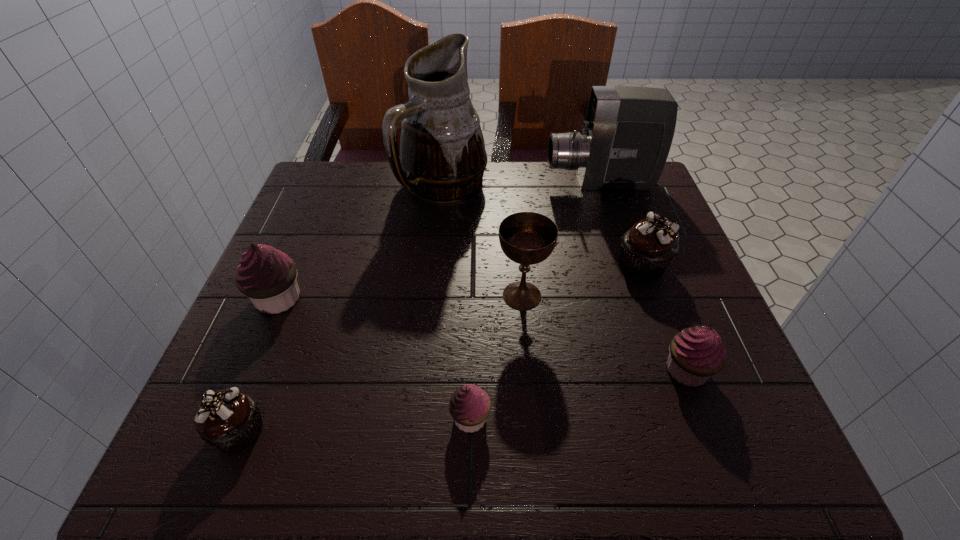
Where is `the third cupcake from right to left`? The height and width of the screenshot is (540, 960). the third cupcake from right to left is located at coordinates (469, 406).

Locate an element on the screen. The height and width of the screenshot is (540, 960). the smallest pink cupcake is located at coordinates (469, 406).

Image resolution: width=960 pixels, height=540 pixels. Identify the location of the left brown cupcake. (230, 420).

At what (x,y) coordinates should I click in order to perform the action: click on the smaller brown cupcake. Please return your answer as a coordinate pair (x, y). Looking at the image, I should click on (230, 420).

Find the location of a particular element. The width and height of the screenshot is (960, 540). vacant space situated 0.110m from the spout of the tallest object is located at coordinates (438, 248).

I want to click on vacant position located at the front of the camcorder, highlighting the lens, so click(x=433, y=183).

You are a GUI agent. You are given a task and a screenshot of the screen. Output one action in this format:
    pyautogui.click(x=<x>, y=<y>)
    Task: Click on the vacant area located 0.380m at the front of the camcorder, highlighting the lens
    This screenshot has height=540, width=960.
    Given the screenshot: What is the action you would take?
    coord(402,183)

This screenshot has height=540, width=960. I want to click on free space located 0.070m at the front of the camcorder, highlighting the lens, so 519,183.

I want to click on free space located 0.260m on the right of the fifth object from left to right, so click(x=676, y=295).

The height and width of the screenshot is (540, 960). Identify the location of vacant space located on the right of the biggest pink cupcake. (474, 299).